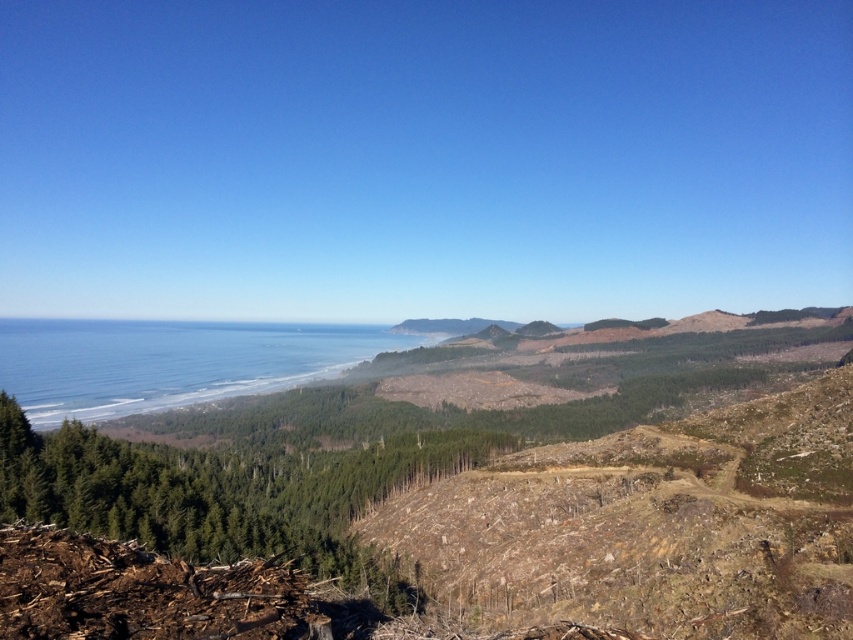
You are a hiker standing on the rugged terrain in the foreground of the coastal landscape. You see the green textured trees at center and the blue water at center. Which object is closer to you?

The green textured trees at center are closer to you than the blue water at center because the green textured trees at center is shorter than blue water at center.

You are standing on the rugged terrain in the foreground of the coastal landscape. You see the green textured trees at center and the blue water at center. Which object is nearer to you?

The green textured trees at center are closer to the viewer than the blue water at center.

You are standing at the origin point in the image. Which direction should you move to reach the green textured trees at center?

The green textured trees at center are located at coordinates point (222,493), so you should move towards the upper right direction from your current position.